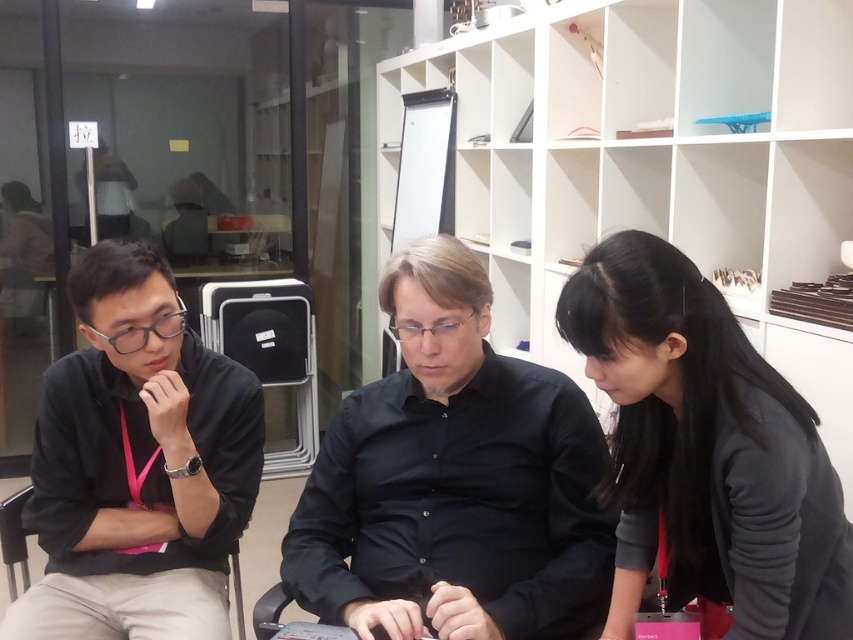
Question: Which of these objects is positioned farthest from the black fabric chair at left?

Choices:
 (A) black matte shirt at left
 (B) black matte hair at lower right
 (C) black matte shirt at center

Answer: (B)

Question: Which object is positioned closest to the black matte shirt at center?

Choices:
 (A) black matte shirt at left
 (B) black fabric chair at left
 (C) black matte hair at lower right

Answer: (C)

Question: Is the position of black matte shirt at center less distant than that of black fabric chair at left?

Choices:
 (A) no
 (B) yes

Answer: (B)

Question: Which point is closer to the camera taking this photo?

Choices:
 (A) (190, 627)
 (B) (233, 602)
 (C) (393, 625)

Answer: (C)

Question: Is black matte hair at lower right thinner than black fabric chair at left?

Choices:
 (A) yes
 (B) no

Answer: (B)

Question: Is black matte shirt at center smaller than black matte shirt at left?

Choices:
 (A) yes
 (B) no

Answer: (B)